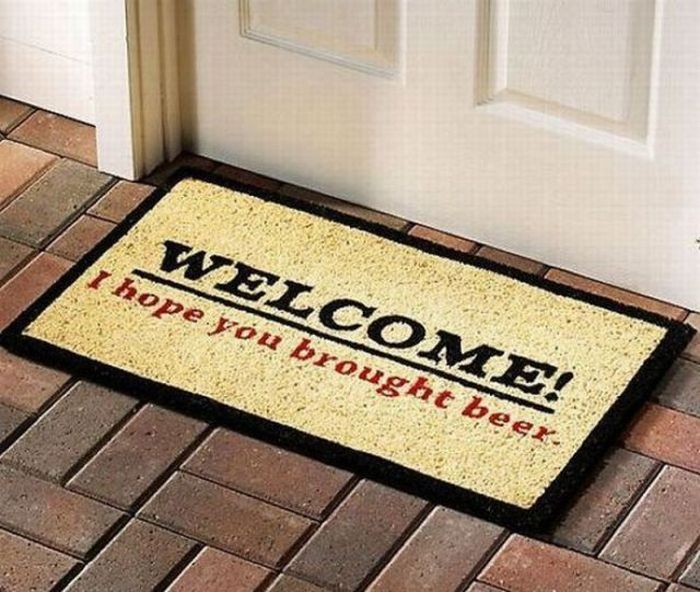
The image size is (700, 592). I want to click on door, so click(x=442, y=150).